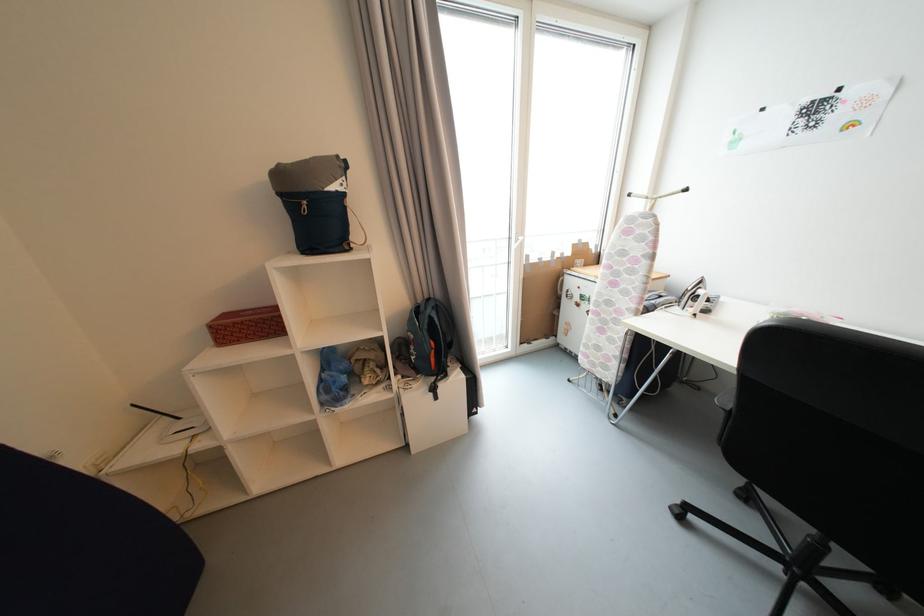
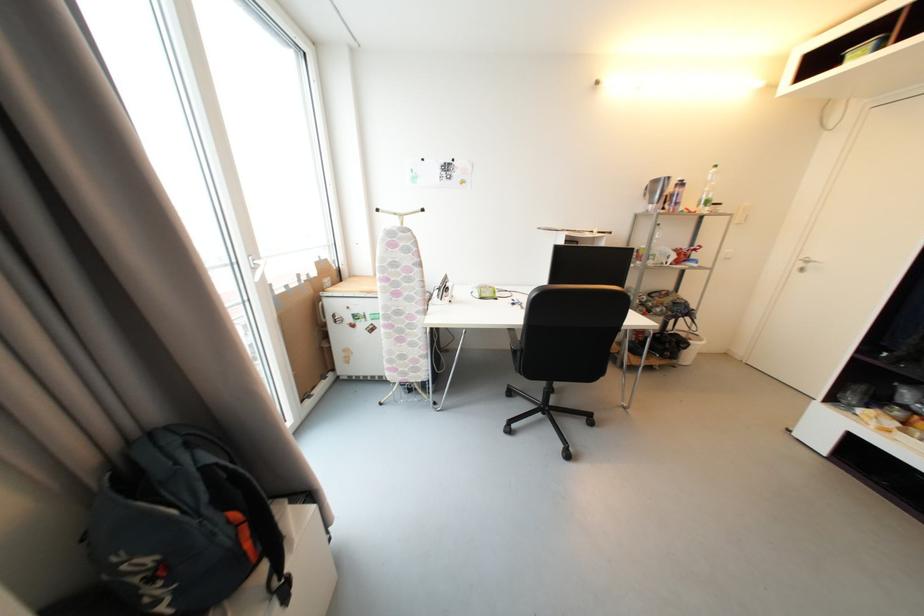
Find the pixel in the second image that matches point (570, 278) in the first image.

(330, 302)